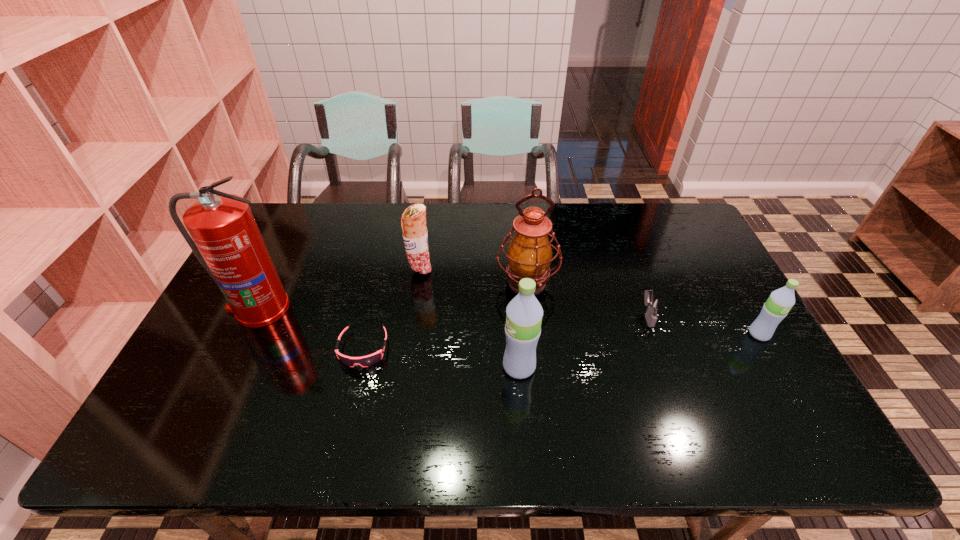
The height and width of the screenshot is (540, 960). Identify the location of the taller water bottle. (524, 313).

Locate an element on the screen. The image size is (960, 540). the nearer water bottle is located at coordinates (524, 313).

You are a GUI agent. You are given a task and a screenshot of the screen. Output one action in this format:
    pyautogui.click(x=<x>, y=<y>)
    Task: Click on the third shortest object
    The width and height of the screenshot is (960, 540).
    Given the screenshot: What is the action you would take?
    pyautogui.click(x=775, y=309)

Identify the location of the right water bottle. [x=775, y=309].

At what (x,y) coordinates should I click in order to perform the action: click on the fifth object from right to left. Please return your answer as a coordinate pair (x, y). The width and height of the screenshot is (960, 540). Looking at the image, I should click on (413, 222).

Identify the location of the fourth tallest object. (413, 222).

I want to click on the tallest object, so click(x=226, y=240).

This screenshot has width=960, height=540. I want to click on the leftmost object, so click(226, 240).

Identify the location of goggles. (365, 361).

Find the location of a particular element. This screenshot has height=540, width=960. the second object from left to right is located at coordinates (365, 361).